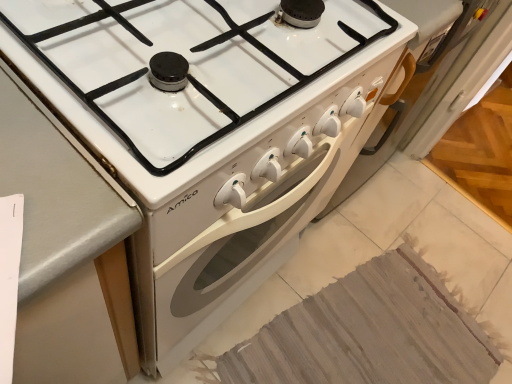
Image resolution: width=512 pixels, height=384 pixels. I want to click on white glossy gas stove at center, so click(x=188, y=62).

Image resolution: width=512 pixels, height=384 pixels. What do you see at coordinates (188, 62) in the screenshot? I see `white glossy gas stove at center` at bounding box center [188, 62].

The image size is (512, 384). What are the coordinates of `white glossy gas stove at center` in the screenshot? It's located at (188, 62).